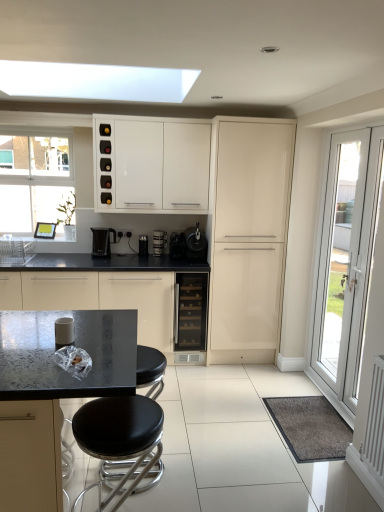
Question: Is metallic black coffee machine at center situated inside white glossy door at right or outside?

Choices:
 (A) inside
 (B) outside

Answer: (B)

Question: In the image, is metallic black coffee machine at center on the left side or the right side of white glossy door at right?

Choices:
 (A) right
 (B) left

Answer: (B)

Question: Which object is positioned farthest from the black plastic coffee machine at center, which is the fourth coffee machine in right-to-left order?

Choices:
 (A) black leather stool at lower center
 (B) satin black coffee machine at center, the fourth coffee machine in the left-to-right sequence
 (C) white glossy door at right
 (D) black plastic coffee machine at center, marked as the 3th coffee machine in a left-to-right arrangement
 (E) black glass wine cooler at center

Answer: (C)

Question: Which object is the farthest from the matte black countertop at center, the first cabinetry in the left-to-right sequence?

Choices:
 (A) black plastic coffee machine at center, which is the fourth coffee machine in right-to-left order
 (B) white glossy cabinet at upper center, marked as the second cabinetry in a right-to-left arrangement
 (C) metallic black coffee machine at center
 (D) black glass wine cooler at center
 (E) satin black coffee machine at center, arranged as the 3th coffee machine when viewed from the right

Answer: (B)